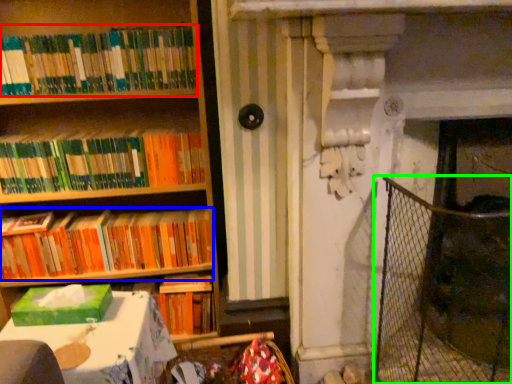
Question: Which is farther away from book (highlighted by a red box)? book (highlighted by a blue box) or fence (highlighted by a green box)?

Choices:
 (A) book
 (B) fence

Answer: (B)